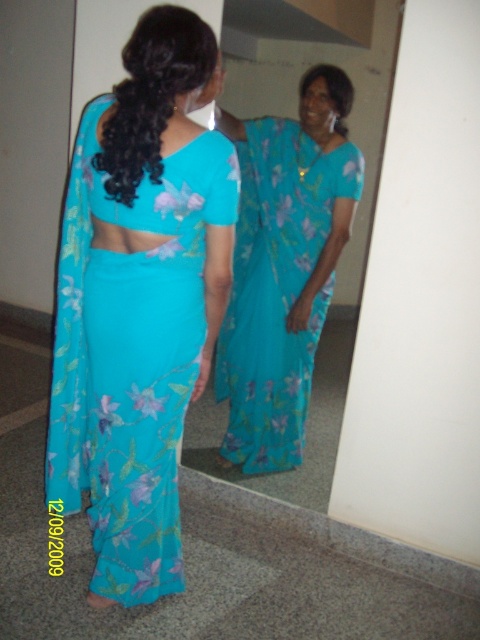
You are taking a photo of two points in the image. The first point is at position point (80, 323) and the second is at point (242, 300). Which point is closer to the camera?

Point (80, 323) is closer to the camera than point (242, 300).

You are a fashion designer who wants to arrange two blue sari options for a photoshoot. The matte blue sari at back and the blue floral saree at center are available. According to the scene, which sari is positioned to the left of the other?

The matte blue sari at back is positioned to the left of the blue floral saree at center.

Consider the image. You are a fashion designer observing the image and need to determine which sari is narrower. Which one is narrower between the matte blue sari at back and the blue floral saree at center?

The matte blue sari at back is narrower than the blue floral saree at center because its width is less than the latter.